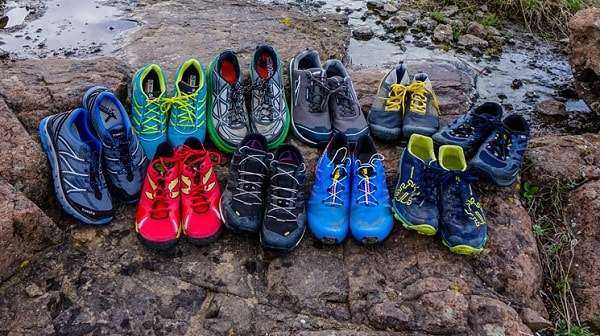
I want to click on shoe in bottom row, so click(x=167, y=212), click(x=199, y=215), click(x=239, y=197), click(x=270, y=209), click(x=325, y=204), click(x=363, y=208), click(x=403, y=204), click(x=447, y=217).